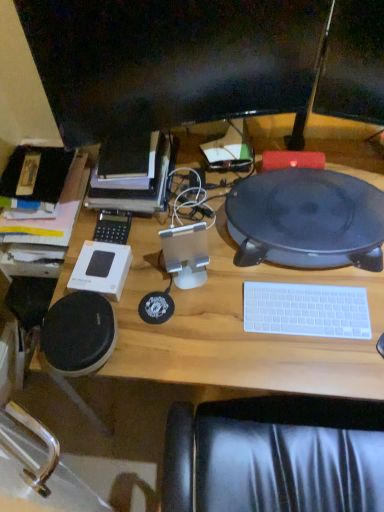
Question: Is black plastic calculator at center-left turned away from matte black tablet at center?

Choices:
 (A) yes
 (B) no

Answer: (B)

Question: Is black plastic calculator at center-left at the right side of matte black tablet at center?

Choices:
 (A) no
 (B) yes

Answer: (A)

Question: From the image's perspective, is black plastic calculator at center-left located above matte black tablet at center?

Choices:
 (A) yes
 (B) no

Answer: (B)

Question: Is black plastic calculator at center-left next to matte black tablet at center?

Choices:
 (A) yes
 (B) no

Answer: (B)

Question: Is black plastic calculator at center-left in front of matte black tablet at center?

Choices:
 (A) no
 (B) yes

Answer: (A)

Question: Looking at the image, does white plastic keyboard at lower right seem bigger or smaller compared to hardcover book at upper left?

Choices:
 (A) small
 (B) big

Answer: (A)

Question: From a real-world perspective, is white plastic keyboard at lower right above or below hardcover book at upper left?

Choices:
 (A) below
 (B) above

Answer: (A)

Question: From their relative heights in the image, would you say white plastic keyboard at lower right is taller or shorter than hardcover book at upper left?

Choices:
 (A) tall
 (B) short

Answer: (B)

Question: Is white plastic keyboard at lower right situated inside hardcover book at upper left or outside?

Choices:
 (A) outside
 (B) inside

Answer: (A)

Question: Is black plastic calculator at center-left spatially inside black glossy monitor at upper center, or outside of it?

Choices:
 (A) outside
 (B) inside

Answer: (A)

Question: In terms of height, does black plastic calculator at center-left look taller or shorter compared to black glossy monitor at upper center?

Choices:
 (A) short
 (B) tall

Answer: (A)

Question: From the image's perspective, is black plastic calculator at center-left positioned above or below black glossy monitor at upper center?

Choices:
 (A) above
 (B) below

Answer: (B)

Question: Considering the relative positions of black plastic calculator at center-left and black glossy monitor at upper center in the image provided, is black plastic calculator at center-left to the left or to the right of black glossy monitor at upper center?

Choices:
 (A) right
 (B) left

Answer: (B)

Question: Considering the positions of white plastic keyboard at lower right and matte black tablet at center in the image, is white plastic keyboard at lower right wider or thinner than matte black tablet at center?

Choices:
 (A) thin
 (B) wide

Answer: (A)

Question: Choose the correct answer: Is white plastic keyboard at lower right inside matte black tablet at center or outside it?

Choices:
 (A) outside
 (B) inside

Answer: (A)